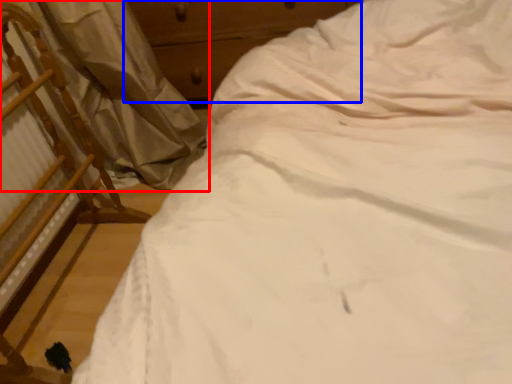
Question: Which point is closer to the camera, curtain (highlighted by a red box) or dresser (highlighted by a blue box)?

Choices:
 (A) curtain
 (B) dresser

Answer: (A)